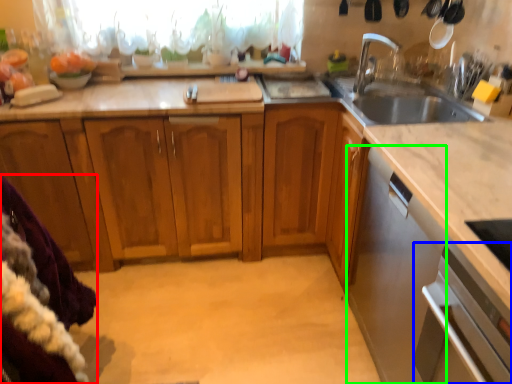
Question: Estimate the real-world distances between objects in this image. Which object is closer to blanket (highlighted by a red box), oven (highlighted by a blue box) or dish washer (highlighted by a green box)?

Choices:
 (A) oven
 (B) dish washer

Answer: (A)